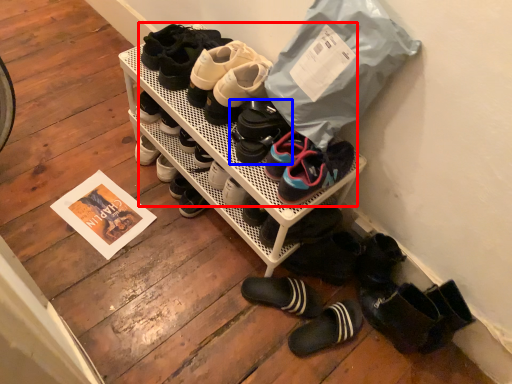
Question: Which object appears closest to the camera in this image, footwear (highlighted by a red box) or footwear (highlighted by a blue box)?

Choices:
 (A) footwear
 (B) footwear

Answer: (A)